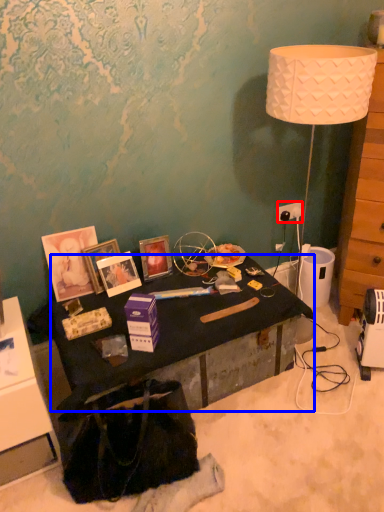
Question: Which of the following is the farthest to the observer, power outlet (highlighted by a red box) or desk (highlighted by a blue box)?

Choices:
 (A) power outlet
 (B) desk

Answer: (A)